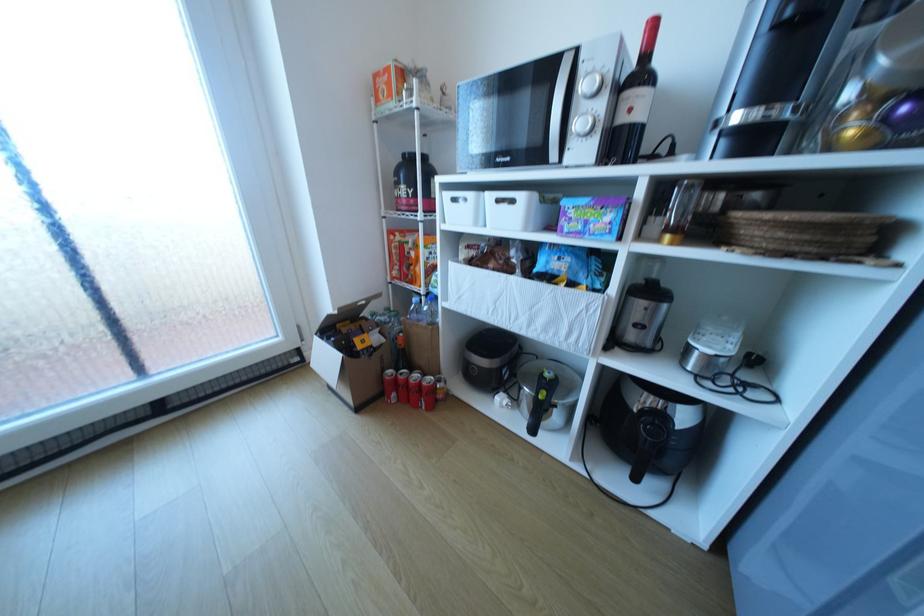
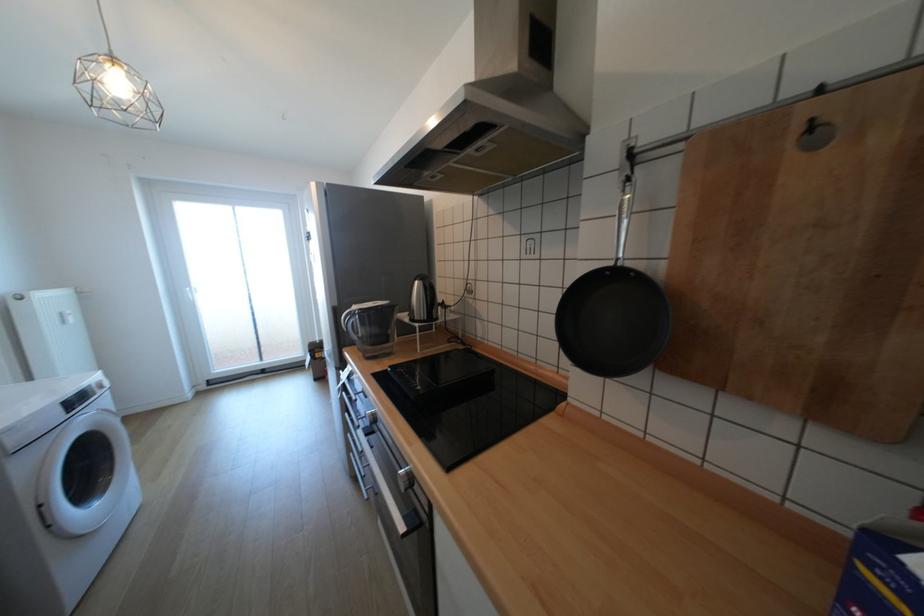
What movement of the cameraman would produce the second image?

The movement direction of the cameraman is right, backward.